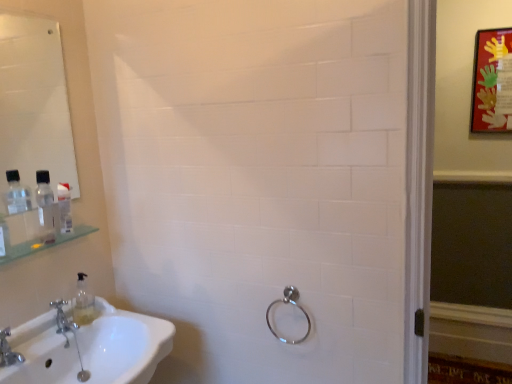
Image resolution: width=512 pixels, height=384 pixels. I want to click on free region under clear glass shelf at left (from a real-world perspective), so click(x=48, y=316).